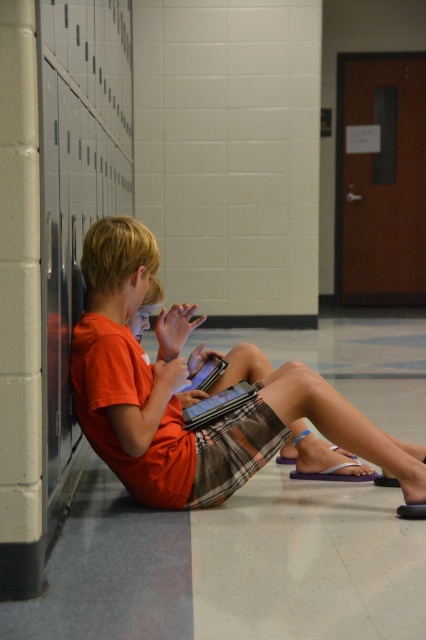
Locate an element on the screen. This screenshot has height=640, width=426. shiny black laptop at center is located at coordinates pos(218,404).

What do you see at coordinates (186, 384) in the screenshot? I see `orange cotton shirt at center` at bounding box center [186, 384].

Does orange cotton shirt at center come behind shiny black laptop at center?

No.

At what (x,y) coordinates should I click in order to perform the action: click on orange cotton shirt at center. Please return your answer as a coordinate pair (x, y). This screenshot has height=640, width=426. Looking at the image, I should click on (186, 384).

Is orange cotton shirt at center bigger than matte black laptop at center?

Yes, orange cotton shirt at center is bigger than matte black laptop at center.

Where is `orange cotton shirt at center`? The height and width of the screenshot is (640, 426). orange cotton shirt at center is located at coordinates (186, 384).